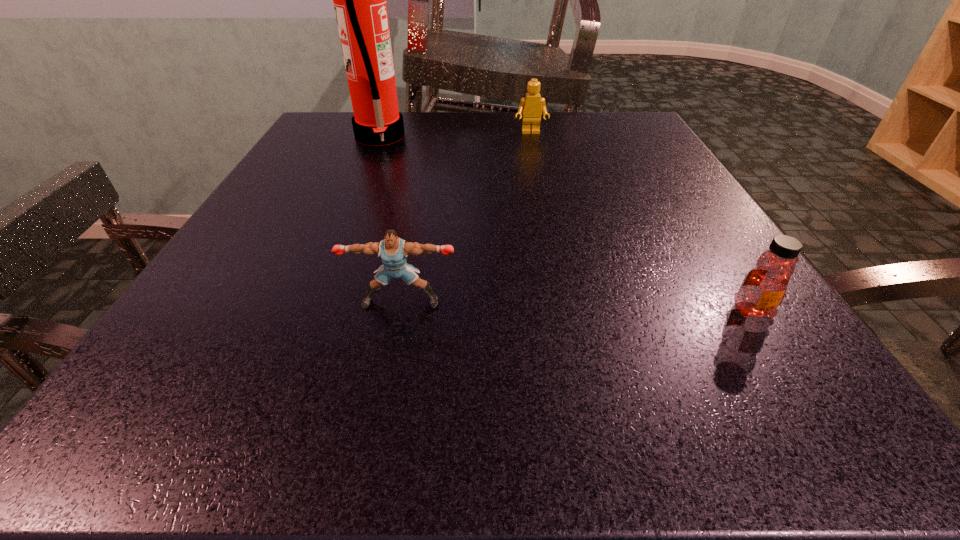
Choose which object is the second nearest neighbor to the puncher. Please provide its 2D coordinates. Your answer should be formatted as a tuple, i.e. [(x, y)], where the tuple contains the x and y coordinates of a point satisfying the conditions above.

[(359, 0)]

Identify which object is the second nearest to the puncher. Please provide its 2D coordinates. Your answer should be formatted as a tuple, i.e. [(x, y)], where the tuple contains the x and y coordinates of a point satisfying the conditions above.

[(359, 0)]

At what (x,y) coordinates should I click in order to perform the action: click on free spot that satisfies the following two spatial constraints: 1. on the face of the Lego; 2. with the nozzle aimed from the tallest object. Please return your answer as a coordinate pair (x, y). Looking at the image, I should click on (532, 137).

Find the location of a particular element. Image resolution: width=960 pixels, height=540 pixels. vacant point that satisfies the following two spatial constraints: 1. on the face of the third object from left to right; 2. with the nozzle aimed from the tallest object is located at coordinates (532, 137).